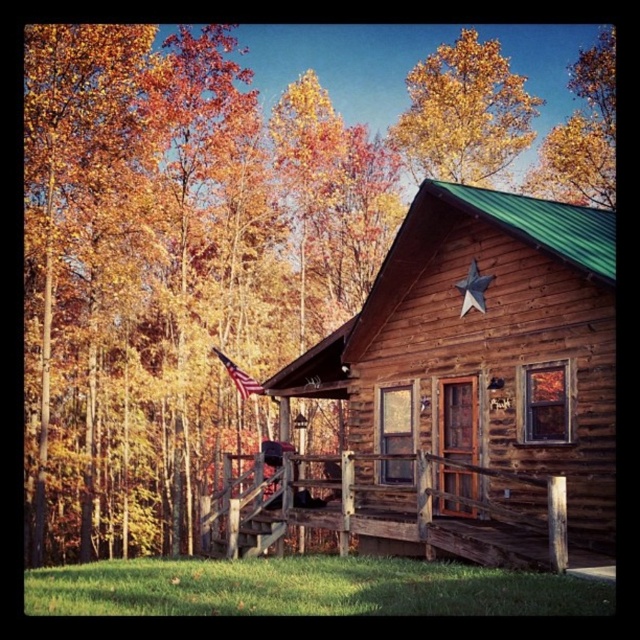
You are standing on the front porch of the rustic wood cabin at center and want to place a 2 meter long wooden bench between the cabin and the american flag at center. Will the bench fit in the space between them?

The rustic wood cabin at center and the american flag at center are 6.91 meters apart. Since the bench is 2 meters long, there is enough space between them to place the bench.

You are standing at the base of the cabin steps and want to hang a wreath on the door. The wreath requires a 20 meter rope to reach from the golden yellow leaves at upper center to the american flag at center. Do you have enough rope?

The golden yellow leaves at upper center and american flag at center are 20.42 meters apart. Since the rope is only 20 meters, it is 0.42 meters short, so you do not have enough rope.

You are standing on the porch of the rustic log cabin and want to determine which of the two points, point (509, 96) or point (253, 388), is closer to you. Based on the scene, which point is nearer?

Point (509, 96) is further to the viewer than point (253, 388). Therefore, point (253, 388) is closer to you.